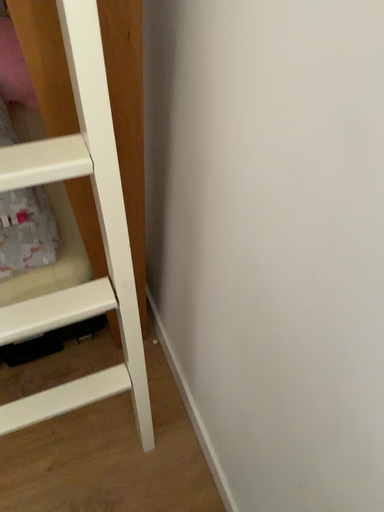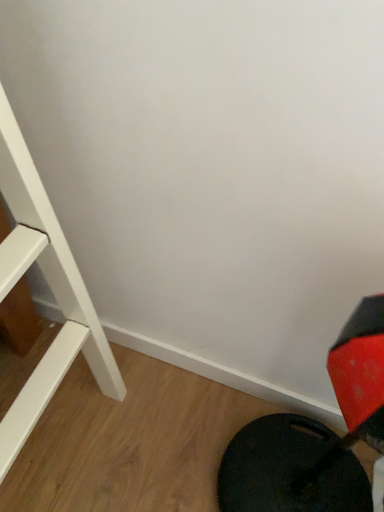
Question: Which way did the camera rotate in the video?

Choices:
 (A) rotated left
 (B) rotated right

Answer: (B)